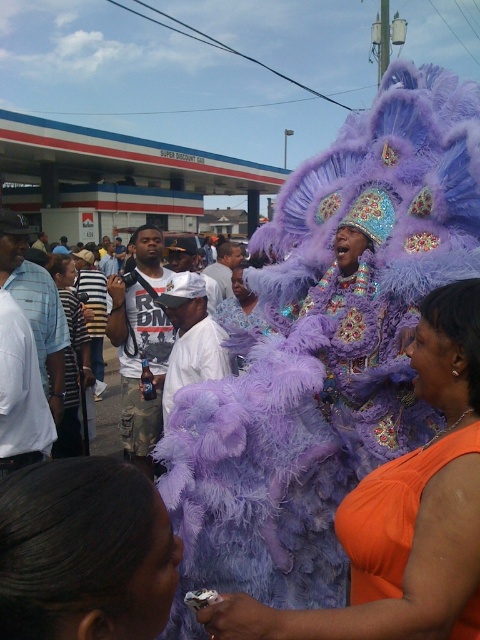
Which of these two, orange satin dress at center or purple feathered headdress at center, stands taller?

orange satin dress at center is taller.

Who is lower down, orange satin dress at center or purple feathered headdress at center?

purple feathered headdress at center is below.

Is point (417, 566) closer to viewer compared to point (409, 545)?

Yes, point (417, 566) is in front of point (409, 545).

Locate an element on the screen. The height and width of the screenshot is (640, 480). orange satin dress at center is located at coordinates (405, 512).

Is smooth purple feathered headdress at center positioned at the back of purple feathered headdress at center?

No.

Who is more forward, [66,496] or [364,481]?

Point [66,496]

At what (x,y) coordinates should I click in order to perform the action: click on smooth purple feathered headdress at center. Please return your answer as a coordinate pair (x, y). The height and width of the screenshot is (640, 480). Looking at the image, I should click on (84, 552).

The height and width of the screenshot is (640, 480). Find the location of `smooth purple feathered headdress at center`. smooth purple feathered headdress at center is located at coordinates (84, 552).

Between orange satin dress at center and smooth purple feathered headdress at center, which one has more height?

With more height is orange satin dress at center.

Is orange satin dress at center above smooth purple feathered headdress at center?

Yes, orange satin dress at center is above smooth purple feathered headdress at center.

Does point (392, 532) come farther from viewer compared to point (15, 522)?

That is True.

What are the coordinates of `orange satin dress at center` in the screenshot? It's located at (405, 512).